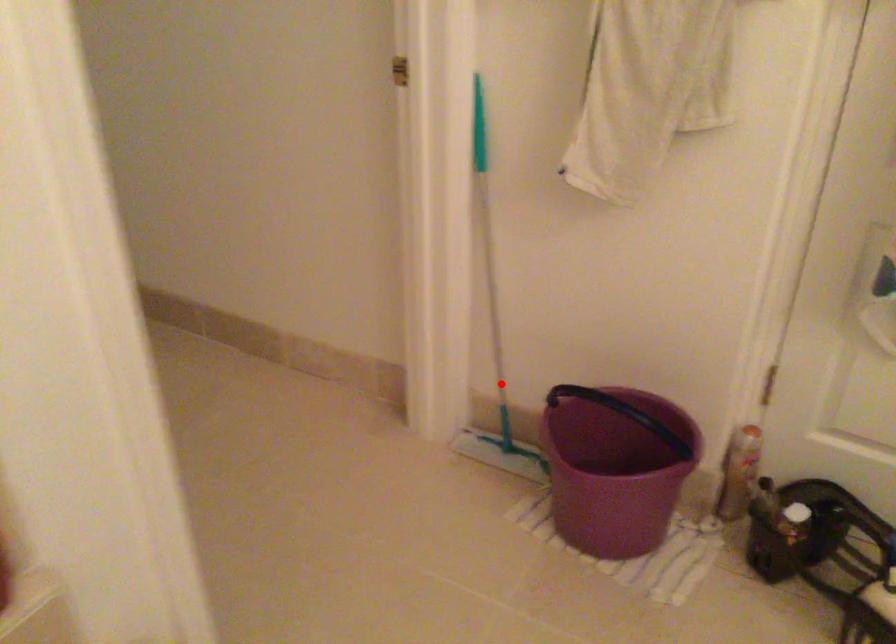
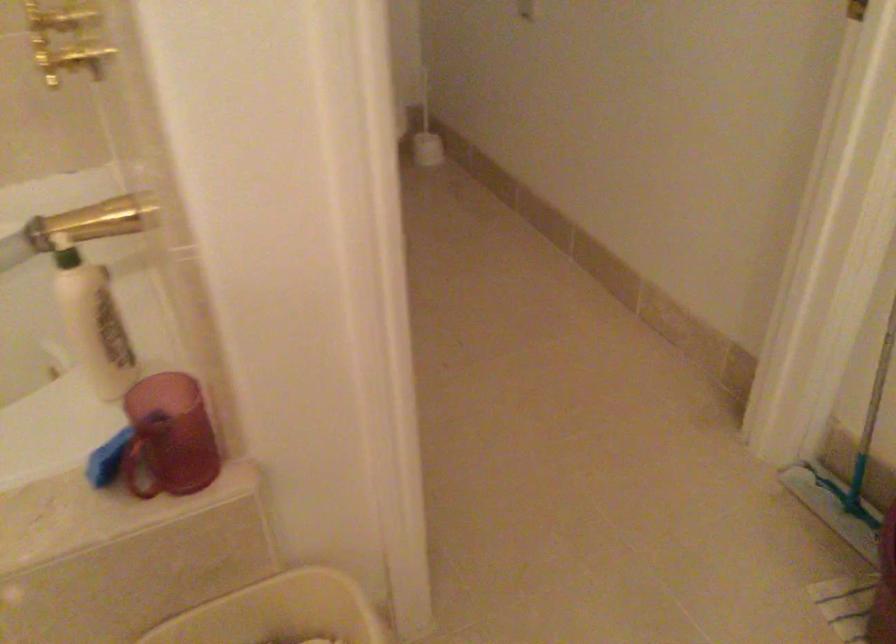
In the second image, find the point that corresponds to the highlighted location in the first image.

(866, 431)